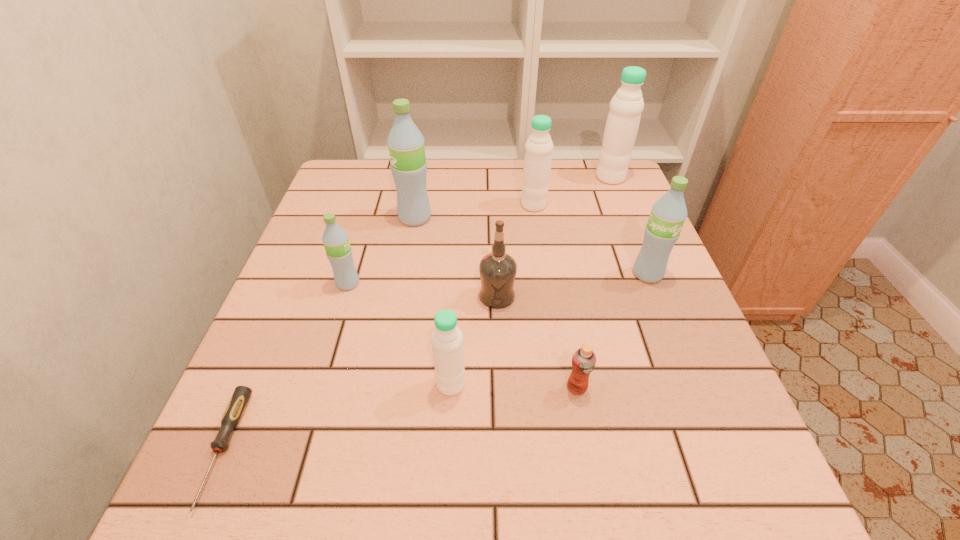
The height and width of the screenshot is (540, 960). In order to click on the nearest white water bottle in this screenshot , I will do `click(447, 339)`.

Locate an element on the screen. the leftmost white water bottle is located at coordinates (447, 339).

Locate an element on the screen. The width and height of the screenshot is (960, 540). the second shortest object is located at coordinates (584, 359).

This screenshot has height=540, width=960. Find the location of `screwdriver`. screwdriver is located at coordinates (237, 404).

Locate an element on the screen. the shortest object is located at coordinates (237, 404).

Where is `blank area located 0.320m on the left of the biggest white water bottle`? The width and height of the screenshot is (960, 540). blank area located 0.320m on the left of the biggest white water bottle is located at coordinates (484, 178).

At what (x,y) coordinates should I click in order to perform the action: click on free space located on the front of the farthest green water bottle. Please return your answer as a coordinate pair (x, y). Looking at the image, I should click on (400, 298).

Identify the location of free location located on the front of the second white water bottle from right to left. This screenshot has height=540, width=960. (545, 284).

I want to click on vacant region located 0.100m on the front of the rightmost green water bottle, so click(x=665, y=320).

Locate an element on the screen. This screenshot has height=540, width=960. free space located 0.380m on the front label of the fifth object from right to left is located at coordinates (298, 295).